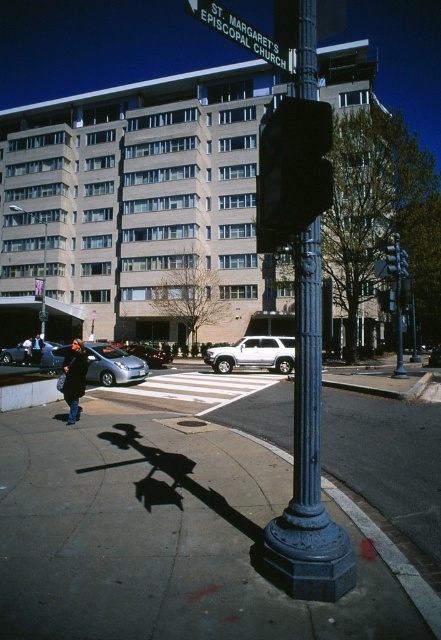
Question: Which point is closer to the camera taking this photo?

Choices:
 (A) (205, 356)
 (B) (310, 468)

Answer: (B)

Question: Does black plastic traffic light at center have a larger size compared to black leather coat at lower left?

Choices:
 (A) yes
 (B) no

Answer: (B)

Question: Does black leather coat at lower left have a smaller size compared to blue cast iron lamp post at lower left?

Choices:
 (A) yes
 (B) no

Answer: (A)

Question: Observing the image, what is the correct spatial positioning of black plastic traffic light at center in reference to silver metallic car at center-left?

Choices:
 (A) above
 (B) below

Answer: (A)

Question: Which of the following is the closest to the observer?

Choices:
 (A) (33, 342)
 (B) (276, 51)
 (C) (127, 349)

Answer: (B)

Question: Which object is positioned closest to the blue cast iron pole at center?

Choices:
 (A) white matte suv at center
 (B) dark blue jacket at lower left
 (C) smooth concrete sidewalk at center
 (D) blue cast iron lamp post at lower left

Answer: (C)